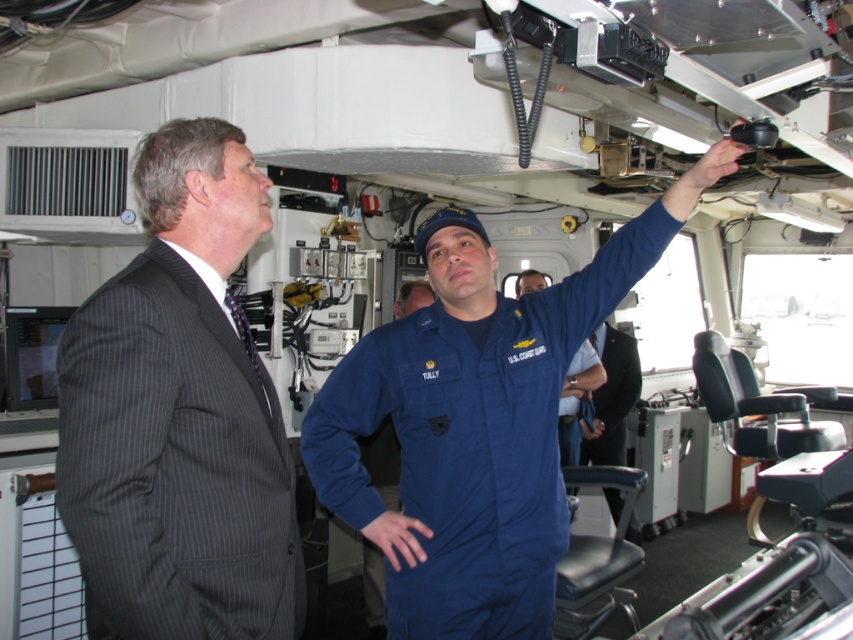
Does point (151, 305) come farther from viewer compared to point (628, 253)?

No, (151, 305) is in front of (628, 253).

Who is more distant from viewer, (273,552) or (579,324)?

The point (579,324) is more distant.

Which is behind, point (233, 266) or point (554, 314)?

Point (554, 314)

You are a GUI agent. You are given a task and a screenshot of the screen. Output one action in this format:
    pyautogui.click(x=<x>, y=<y>)
    Task: Click on the dark gray pinstripe suit at left
    
    Given the screenshot: What is the action you would take?
    pyautogui.click(x=178, y=416)